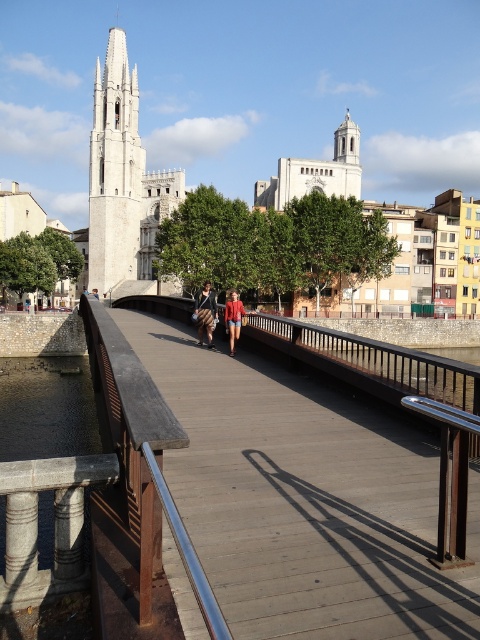
Based on the photo, you are a delivery drone that needs to pass through the area between the wooden bridge at center and the striped fabric skirt at center. Your drone has a wingspan of 1.2 meters. Can you safely navigate through the space between them?

The wooden bridge at center might be wider than striped fabric skirt at center, so the space between them may be sufficient for the drone with a 1.2 meter wingspan to pass through safely.

You are standing on the pedestrian bridge and looking towards the Gothic church tower. There are two points marked on the bridge deck, one at coordinates point (206,296) and the other at point (233,328). Which point is closer to you as you stand on the bridge?

Point (206,296) is further to the camera than point (233,328), so the point closer to you is point (233,328).

You are a photographer planning to take a picture of the wooden bridge at center and the matte red shorts at center from a position where both are visible. Which object will appear taller in the photo?

The wooden bridge at center will appear taller in the photo since it has a greater height compared to the matte red shorts at center.